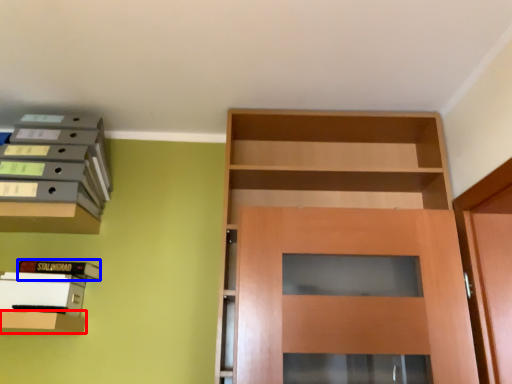
Question: Which object appears farthest to the camera in this image, shelf (highlighted by a red box) or book (highlighted by a blue box)?

Choices:
 (A) shelf
 (B) book

Answer: (B)